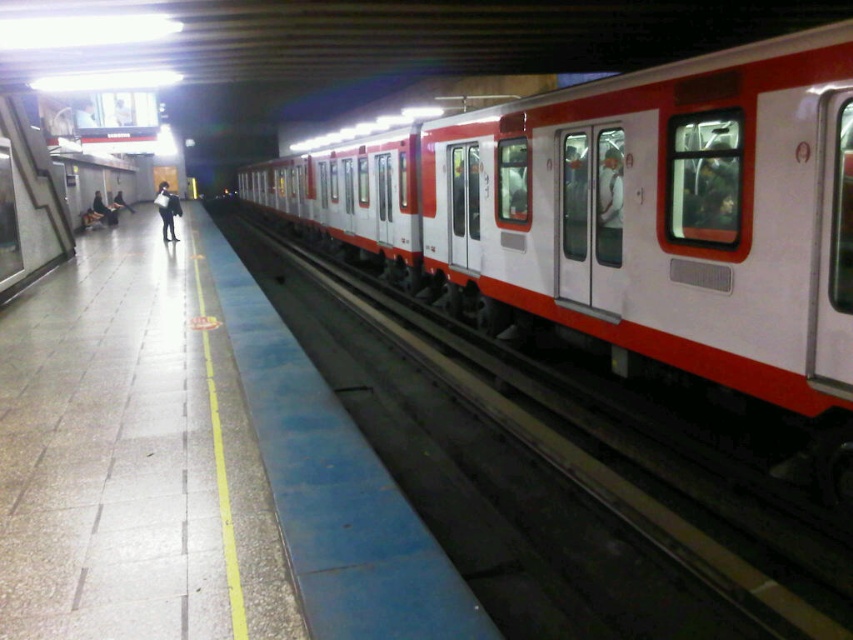
You are standing on the subway platform and want to know which of the two points, point (695, 490) or point (113, 211), is closer to you. Based on the image, which point is nearer?

Point (695, 490) is closer to the viewer than point (113, 211).

You are standing on the subway platform and notice the white rubber track at right and the dark blue jeans at left. Which object is taller from your perspective?

The white rubber track at right is much taller than the dark blue jeans at left.